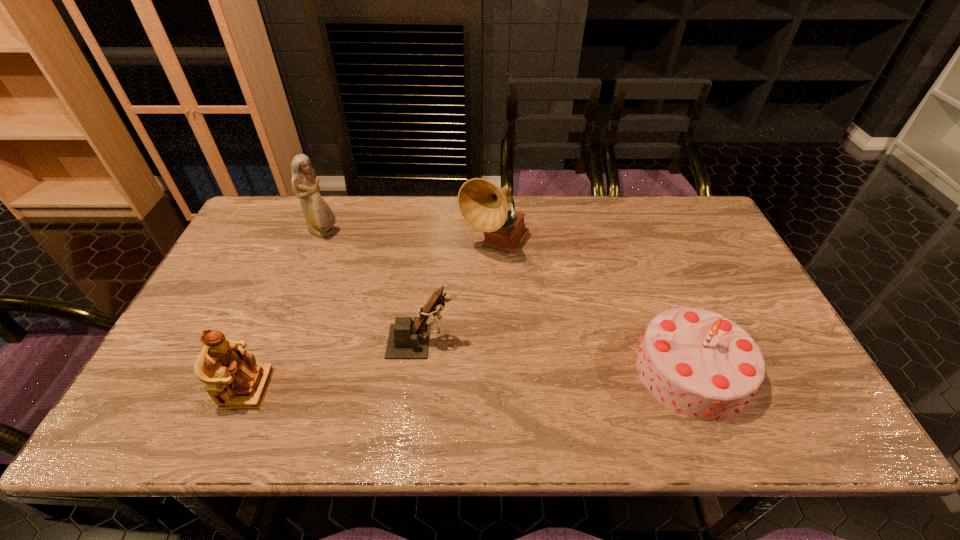
The height and width of the screenshot is (540, 960). What are the coordinates of `empty space between the phonograph record and the second farthest figurine` in the screenshot? It's located at (458, 294).

Locate which object ranks fourth in proximity to the phonograph record. Please provide its 2D coordinates. Your answer should be formatted as a tuple, i.e. [(x, y)], where the tuple contains the x and y coordinates of a point satisfying the conditions above.

[(233, 379)]

Choose which object is the fourth nearest neighbor to the rightmost object. Please provide its 2D coordinates. Your answer should be formatted as a tuple, i.e. [(x, y)], where the tuple contains the x and y coordinates of a point satisfying the conditions above.

[(319, 217)]

Choose which figurine is the nearest neighbor to the rightmost figurine. Please provide its 2D coordinates. Your answer should be formatted as a tuple, i.e. [(x, y)], where the tuple contains the x and y coordinates of a point satisfying the conditions above.

[(233, 379)]

Locate which figurine is the closest to the nearest figurine. Please provide its 2D coordinates. Your answer should be formatted as a tuple, i.e. [(x, y)], where the tuple contains the x and y coordinates of a point satisfying the conditions above.

[(408, 339)]

Image resolution: width=960 pixels, height=540 pixels. In order to click on free spot that satisfies the following two spatial constraints: 1. on the horn of the birthday cake; 2. on the left side of the phonograph record in this screenshot , I will do `click(499, 371)`.

Image resolution: width=960 pixels, height=540 pixels. Identify the location of free spot that satisfies the following two spatial constraints: 1. on the front-facing side of the rightmost object; 2. on the left side of the tallest figurine. (269, 371).

The width and height of the screenshot is (960, 540). In order to click on vacant space that satisfies the following two spatial constraints: 1. on the front side of the rightmost object; 2. on the front-facing side of the nearest figurine in this screenshot , I will do `click(699, 388)`.

Image resolution: width=960 pixels, height=540 pixels. I want to click on vacant region that satisfies the following two spatial constraints: 1. on the horn of the phonograph record; 2. on the front-facing side of the second nearest figurine, so click(x=498, y=342).

You are a GUI agent. You are given a task and a screenshot of the screen. Output one action in this format:
    pyautogui.click(x=<x>, y=<y>)
    Task: Click on the vacant space that satisfies the following two spatial constraints: 1. on the front-facing side of the tallest figurine; 2. on the back side of the birthday cake
    
    Given the screenshot: What is the action you would take?
    pyautogui.click(x=269, y=371)